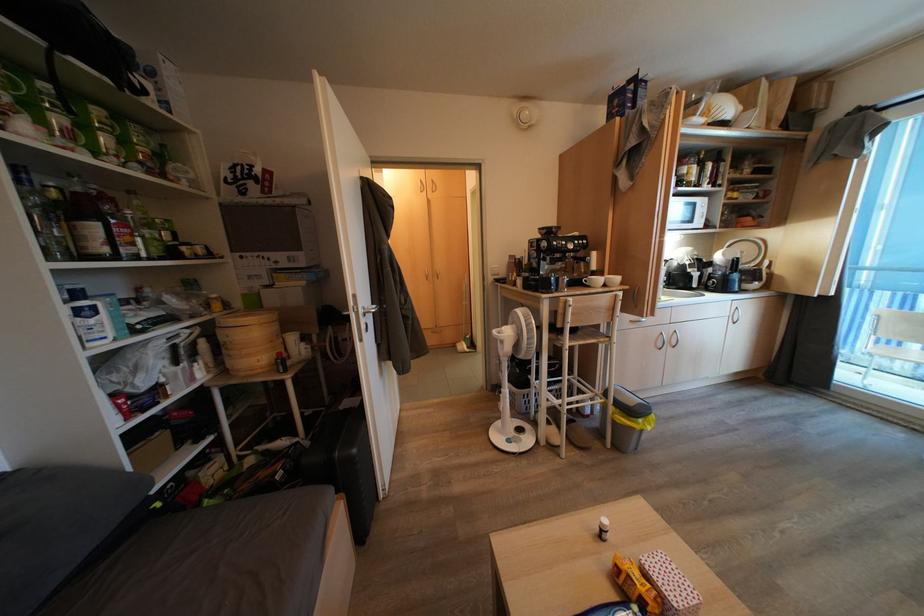
Find where to sit the chair sitting surface. Please return your answer as a coordinate pair (x, y).

(580, 358)